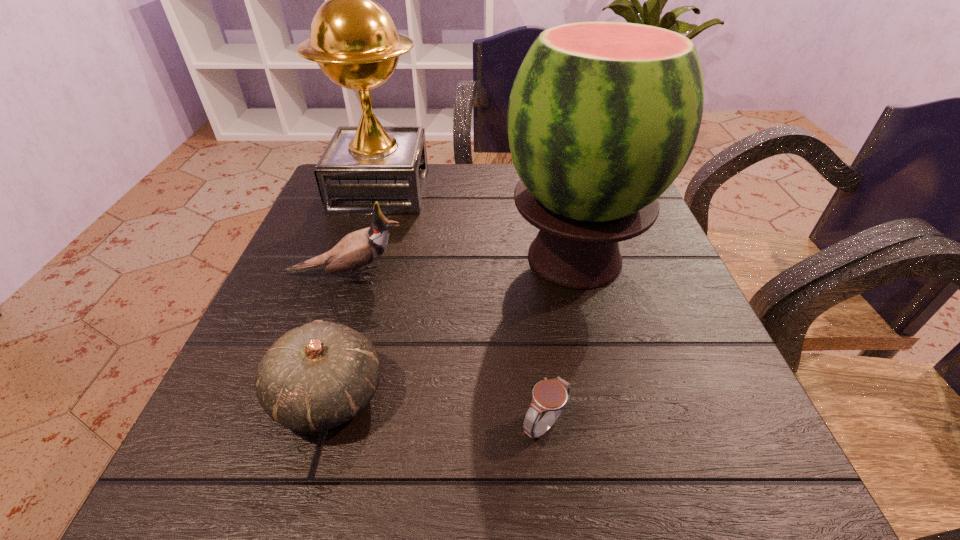
Where is `vacant space at the near edge of the desktop`? This screenshot has height=540, width=960. vacant space at the near edge of the desktop is located at coordinates (x=547, y=484).

The width and height of the screenshot is (960, 540). I want to click on vacant space at the left edge, so (x=337, y=285).

Where is `free space at the right edge of the desktop`? This screenshot has height=540, width=960. free space at the right edge of the desktop is located at coordinates (666, 269).

This screenshot has height=540, width=960. What are the coordinates of `blank area at the near left corner` in the screenshot? It's located at (198, 458).

Locate an element on the screen. The image size is (960, 540). free point between the gourd and the watermelon is located at coordinates (452, 327).

Find the location of a particular element. The width and height of the screenshot is (960, 540). empty location between the fourth tallest object and the watermelon is located at coordinates (452, 327).

Identify the location of free space between the fourth tallest object and the shortest object. This screenshot has height=540, width=960. (437, 411).

Image resolution: width=960 pixels, height=540 pixels. I want to click on unoccupied area between the third tallest object and the watermelon, so click(460, 267).

Find the location of `vacant region between the third tallest object and the shortest object`. vacant region between the third tallest object and the shortest object is located at coordinates (445, 350).

You are a GUI agent. You are given a task and a screenshot of the screen. Output one action in this format:
    pyautogui.click(x=<x>, y=<y>)
    Task: Click on the free area in between the farthest object and the watermelon
    This screenshot has height=540, width=960.
    Given the screenshot: What is the action you would take?
    pyautogui.click(x=478, y=224)